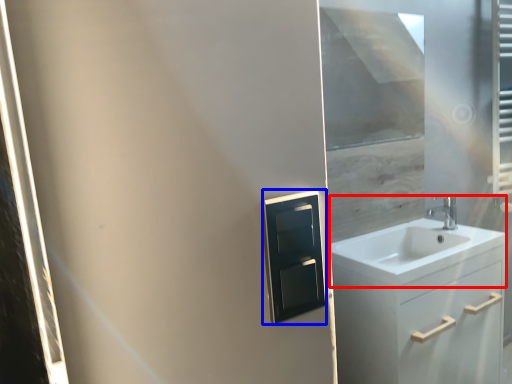
Question: Which object appears closest to the camera in this image, sink (highlighted by a red box) or medicine cabinet (highlighted by a blue box)?

Choices:
 (A) sink
 (B) medicine cabinet

Answer: (B)